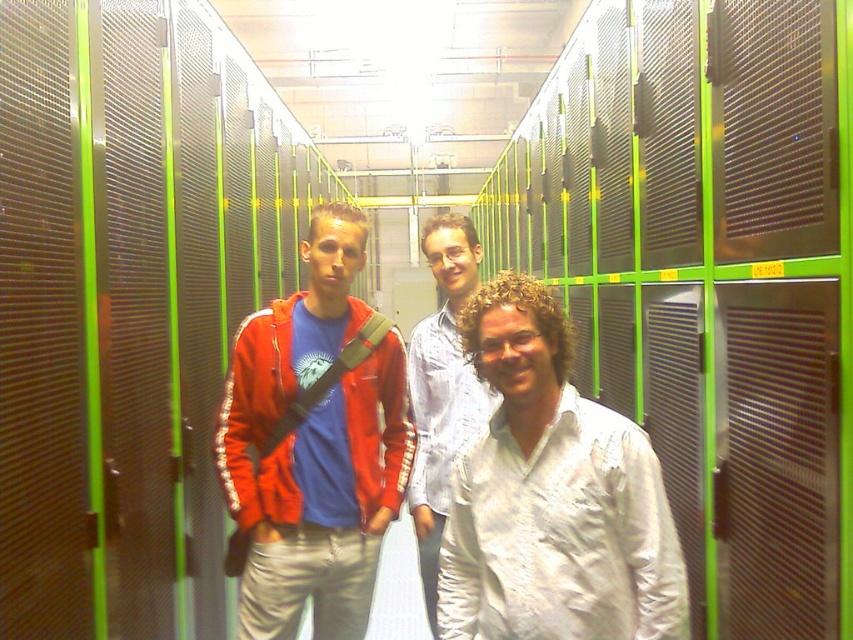
Question: Where is white satin shirt at center located in relation to matte red jacket at center in the image?

Choices:
 (A) right
 (B) left

Answer: (A)

Question: Which of the following is the farthest from the observer?

Choices:
 (A) white satin shirt at center
 (B) matte red jacket at center
 (C) white textured shirt at center

Answer: (B)

Question: Can you confirm if white satin shirt at center is positioned below matte red jacket at center?

Choices:
 (A) yes
 (B) no

Answer: (B)

Question: Is white satin shirt at center in front of matte red jacket at center?

Choices:
 (A) yes
 (B) no

Answer: (A)

Question: Which of the following is the closest to the observer?

Choices:
 (A) (334, 284)
 (B) (583, 516)

Answer: (B)

Question: Which point is farther from the camera taking this photo?

Choices:
 (A) (465, 428)
 (B) (361, 250)

Answer: (A)